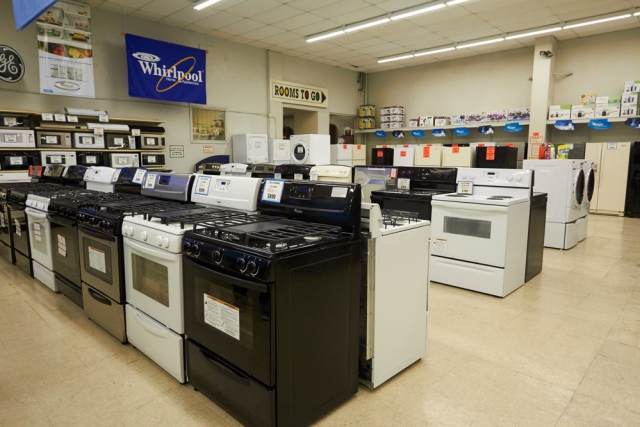
Locate an element on the screen. Image resolution: width=640 pixels, height=427 pixels. refrigerators is located at coordinates point(604,178), point(460,152), point(417,154).